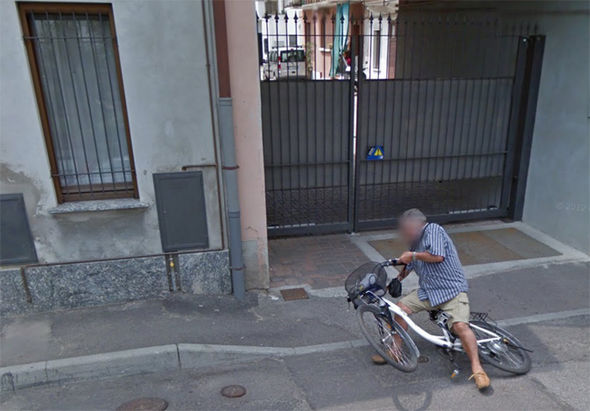
Image resolution: width=590 pixels, height=411 pixels. I want to click on window, so click(x=84, y=110).